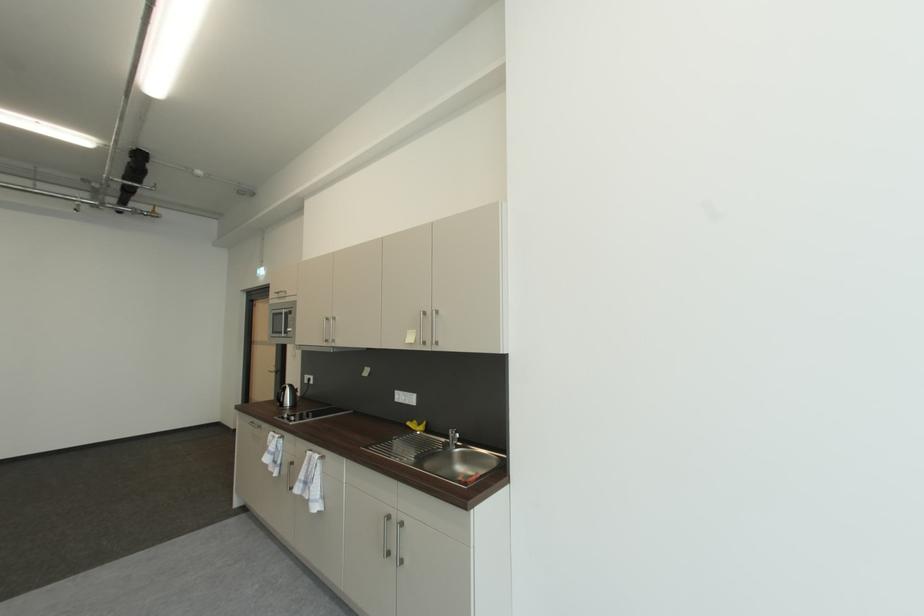
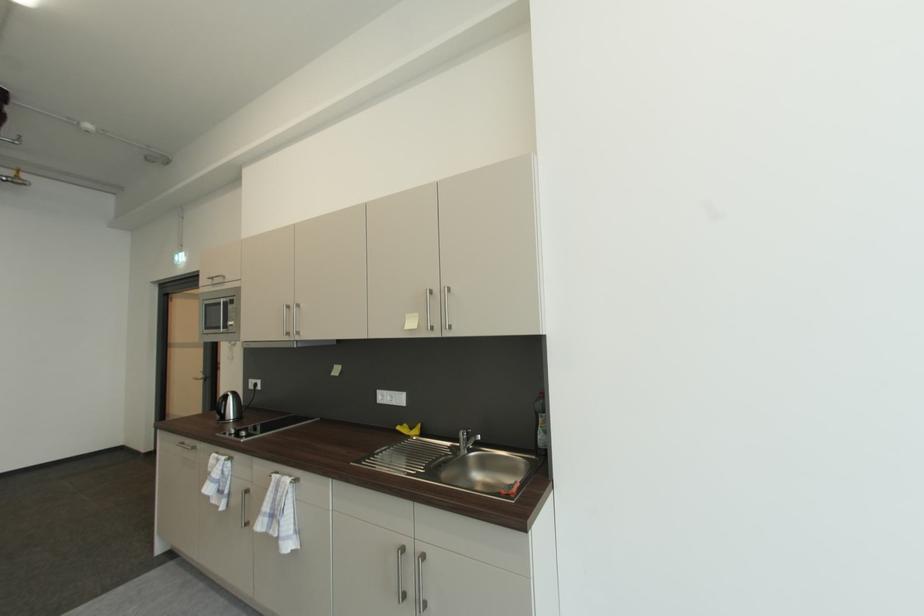
Find the pixel in the second image that matches point (287, 392) in the first image.

(227, 402)